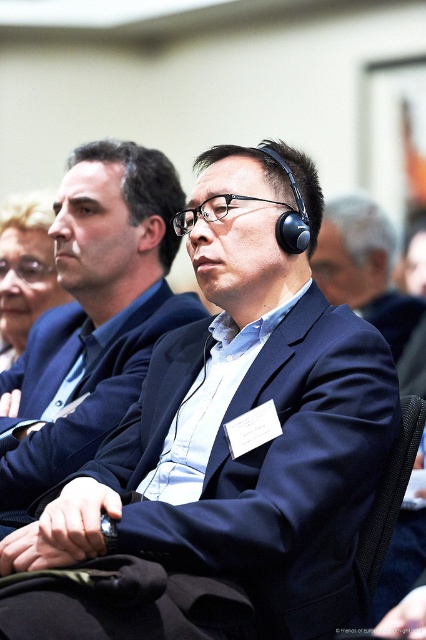
Question: Which object is positioned farthest from the matte black suit at left?

Choices:
 (A) black fabric chair at lower right
 (B) navy blue fabric business suit at center
 (C) matte black suit at center

Answer: (A)

Question: Does navy blue fabric business suit at center appear on the right side of black fabric chair at lower right?

Choices:
 (A) yes
 (B) no

Answer: (B)

Question: Which of these objects is positioned farthest from the matte black suit at center?

Choices:
 (A) navy blue fabric business suit at center
 (B) matte black suit at left
 (C) matte black headphones at center
 (D) black fabric chair at lower right

Answer: (C)

Question: Is matte black headphones at center below black fabric chair at lower right?

Choices:
 (A) no
 (B) yes

Answer: (A)

Question: Based on their relative distances, which object is nearer to the matte black headphones at center?

Choices:
 (A) navy blue fabric business suit at center
 (B) matte black suit at left

Answer: (B)

Question: Can you confirm if matte black headphones at center is thinner than black fabric chair at lower right?

Choices:
 (A) yes
 (B) no

Answer: (B)